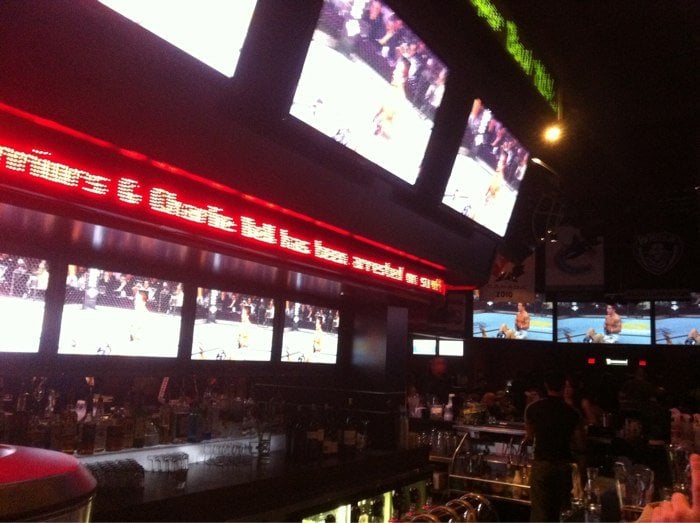
Where is `ceiling`? The height and width of the screenshot is (523, 700). ceiling is located at coordinates (645, 35).